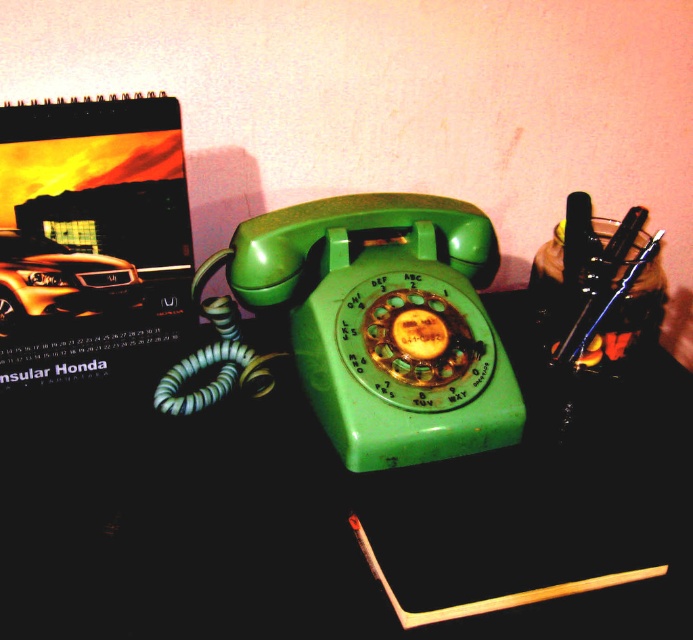
Which is more to the left, green plastic rotary phone at center or wooden matchstick at lower center?

green plastic rotary phone at center is more to the left.

Looking at this image, which of these two, green plastic rotary phone at center or wooden matchstick at lower center, stands shorter?

Standing shorter between the two is wooden matchstick at lower center.

Does point (229, 284) come in front of point (577, 584)?

No, it is behind (577, 584).

You are a GUI agent. You are given a task and a screenshot of the screen. Output one action in this format:
    pyautogui.click(x=<x>, y=<y>)
    Task: Click on the green plastic rotary phone at center
    
    Given the screenshot: What is the action you would take?
    pyautogui.click(x=368, y=324)

Identify the location of green plastic telephone at center. Image resolution: width=693 pixels, height=640 pixels. (319, 500).

Does point (62, 438) lie in front of point (428, 198)?

Yes.

Who is more forward, [667,532] or [238,269]?

Point [667,532]

Locate an element on the screen. green plastic telephone at center is located at coordinates (319, 500).

Does matte paper notebook at upper left come behind metallic orange car at upper left?

No.

You are a GUI agent. You are given a task and a screenshot of the screen. Output one action in this format:
    pyautogui.click(x=<x>, y=<y>)
    Task: Click on the matte paper notebook at upper left
    The image size is (693, 640).
    Given the screenshot: What is the action you would take?
    pyautogui.click(x=89, y=234)